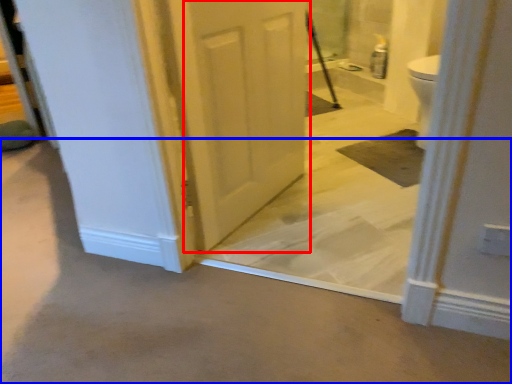
Question: Which of the following is the farthest to the observer, door (highlighted by a red box) or concrete (highlighted by a blue box)?

Choices:
 (A) door
 (B) concrete

Answer: (A)